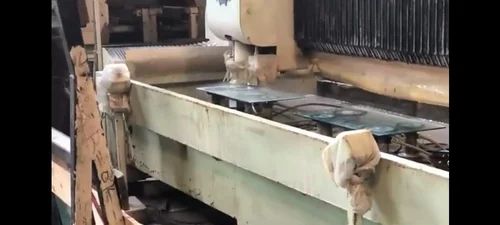
Identify the location of wooden plank. (x=60, y=189).